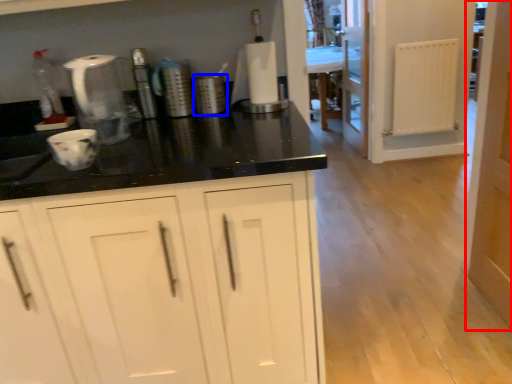
Question: Which of the following is the closest to the observer, door (highlighted by a red box) or appliance (highlighted by a blue box)?

Choices:
 (A) door
 (B) appliance

Answer: (A)